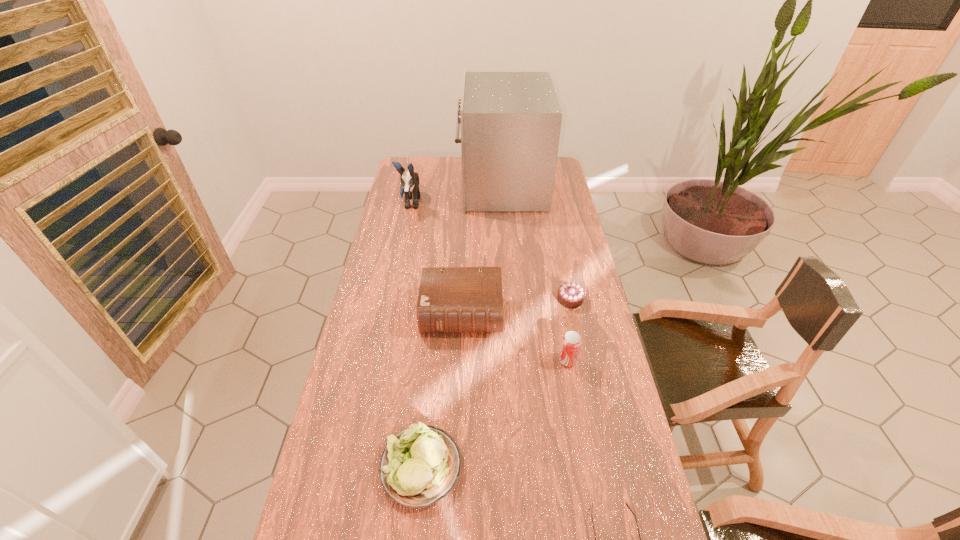
Identify the location of free space located 0.090m on the front-facing side of the puppy. The image size is (960, 540). (404, 231).

At what (x,y) coordinates should I click in order to perform the action: click on free space located 0.310m on the spine side of the Bible. Please return your answer as a coordinate pair (x, y). Looking at the image, I should click on (x=458, y=428).

You are a GUI agent. You are given a task and a screenshot of the screen. Output one action in this format:
    pyautogui.click(x=<x>, y=<y>)
    Task: Click on the vacant space located 0.300m on the logo side of the fifth farthest object
    This screenshot has height=540, width=960.
    Given the screenshot: What is the action you would take?
    pyautogui.click(x=461, y=360)

At what (x,y) coordinates should I click in order to perform the action: click on vacant space located 0.150m on the logo side of the fifth farthest object. Please return your answer as a coordinate pair (x, y). The width and height of the screenshot is (960, 540). Looking at the image, I should click on (510, 360).

Where is `vacant space situated on the logo side of the fifth farthest object`? Image resolution: width=960 pixels, height=540 pixels. vacant space situated on the logo side of the fifth farthest object is located at coordinates (513, 360).

Where is `vacant space located on the back of the lettuce`? This screenshot has height=540, width=960. vacant space located on the back of the lettuce is located at coordinates (435, 332).

Identify the location of free point located on the left of the sixth tallest object. (494, 299).

This screenshot has height=540, width=960. I want to click on object situated at the far edge, so click(510, 122).

Identify the location of puppy positioned at the left edge. Image resolution: width=960 pixels, height=540 pixels. (410, 181).

Locate an element on the screen. lettuce that is at the left edge is located at coordinates (420, 465).